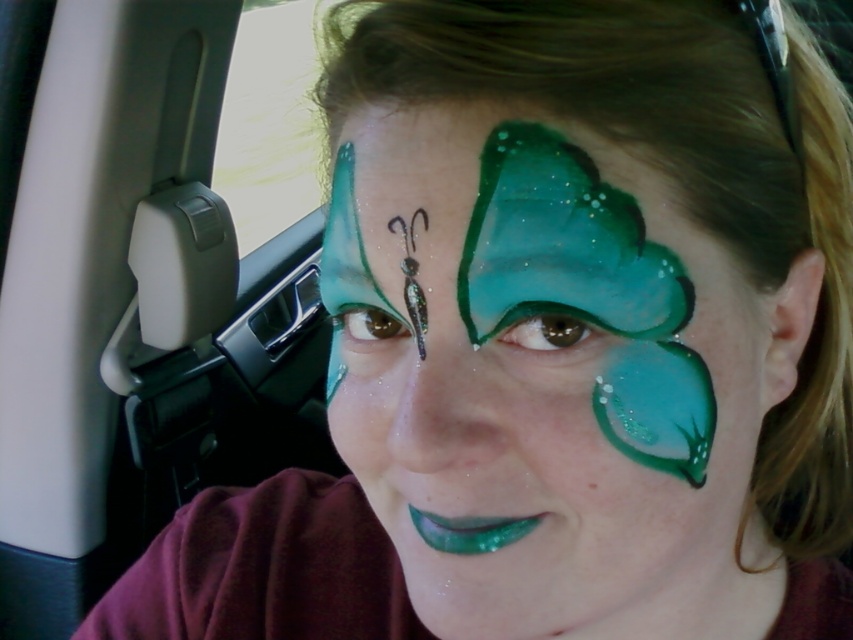
You are a makeup artist trying to apply the same butterfly design as the shiny green paint at center on a client. You have a brush that can cover an area up to the width of the transparent glass car window at upper left. Will your brush be sufficient to apply the design?

The shiny green paint at center has a lesser width compared to the transparent glass car window at upper left, so the brush can cover the area since it is wider than the design requires.

You are a makeup artist trying to replicate the butterfly design on your client. The client wants to know where to place the shiny green paint. Based on the image, where should the shiny green paint at center be placed?

The shiny green paint at center should be placed at the 2D coordinates point (x=543, y=378).

You are a makeup artist observing the person in the car. You need to determine if the shiny green paint at center will fit entirely within the transparent glass car window at upper left when the window is fully opened. Can you confirm?

The shiny green paint at center has a smaller size compared to transparent glass car window at upper left, so it can fit entirely within the window when opened fully.